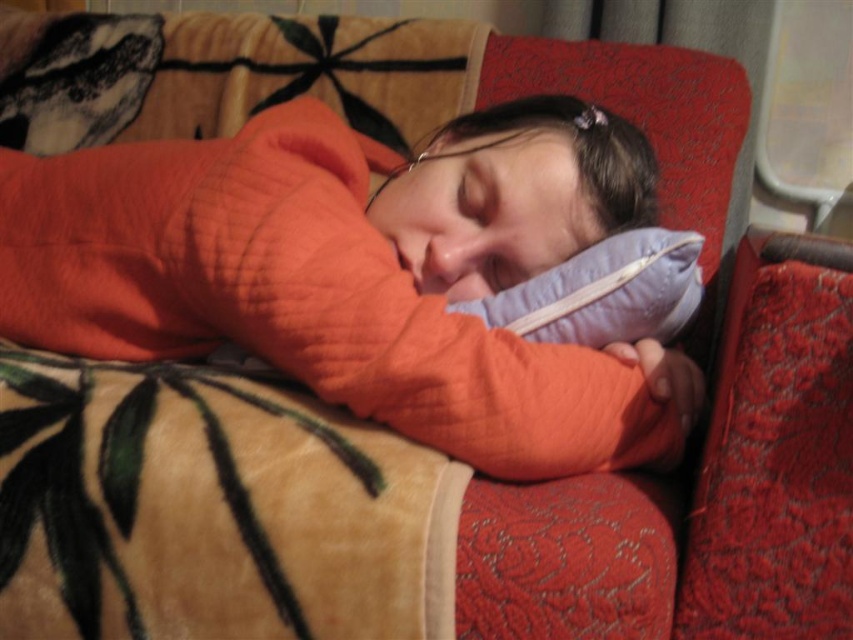
What do you see at coordinates (358, 273) in the screenshot?
I see `orange quilted sweater at center` at bounding box center [358, 273].

Is point (453, 148) more distant than point (642, 304)?

Yes.

I want to click on orange quilted sweater at center, so click(x=358, y=273).